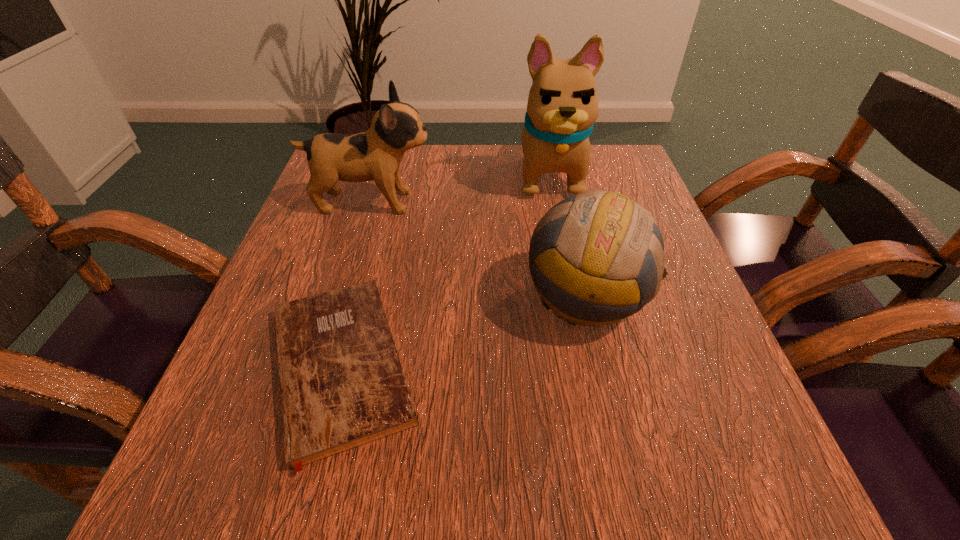
The width and height of the screenshot is (960, 540). I want to click on vacant space at the left edge, so click(340, 227).

The width and height of the screenshot is (960, 540). What are the coordinates of `free space at the right edge of the desktop` in the screenshot? It's located at (694, 372).

Where is `free region at the near left corner`? The image size is (960, 540). free region at the near left corner is located at coordinates (214, 461).

The height and width of the screenshot is (540, 960). I want to click on free space at the far right corner of the desktop, so click(x=629, y=161).

At what (x,y) coordinates should I click in order to perform the action: click on free space at the near right corner. Please return your answer as a coordinate pair (x, y). Image resolution: width=960 pixels, height=540 pixels. Looking at the image, I should click on (745, 453).

Identify the location of free space between the third tallest object and the shortest object. (464, 332).

Identify the location of blank region between the second shortest object and the shorter puppy. The width and height of the screenshot is (960, 540). (479, 250).

Image resolution: width=960 pixels, height=540 pixels. Find the location of `free space between the volleyball and the shorter puppy`. free space between the volleyball and the shorter puppy is located at coordinates (479, 250).

You are a GUI agent. You are given a task and a screenshot of the screen. Output one action in this format:
    pyautogui.click(x=<x>, y=<y>)
    Task: Click on the free space between the shorter puppy and the shortest object
    This screenshot has width=960, height=540.
    Given the screenshot: What is the action you would take?
    pyautogui.click(x=356, y=284)

Find the location of a particular element. This screenshot has height=540, width=960. free area in between the Bible and the volleyball is located at coordinates (464, 332).